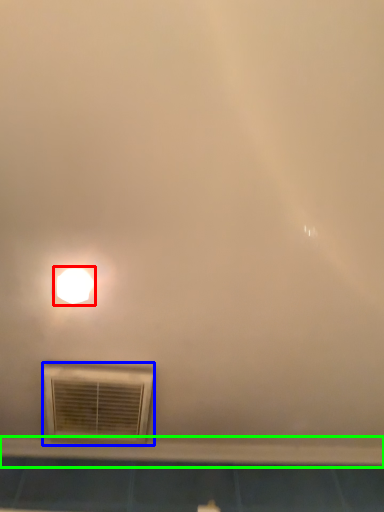
Question: Based on their relative distances, which object is nearer to lamp (highlighted by a red box)? Choose from air conditioning (highlighted by a blue box) and window sill (highlighted by a green box).

Choices:
 (A) air conditioning
 (B) window sill

Answer: (A)